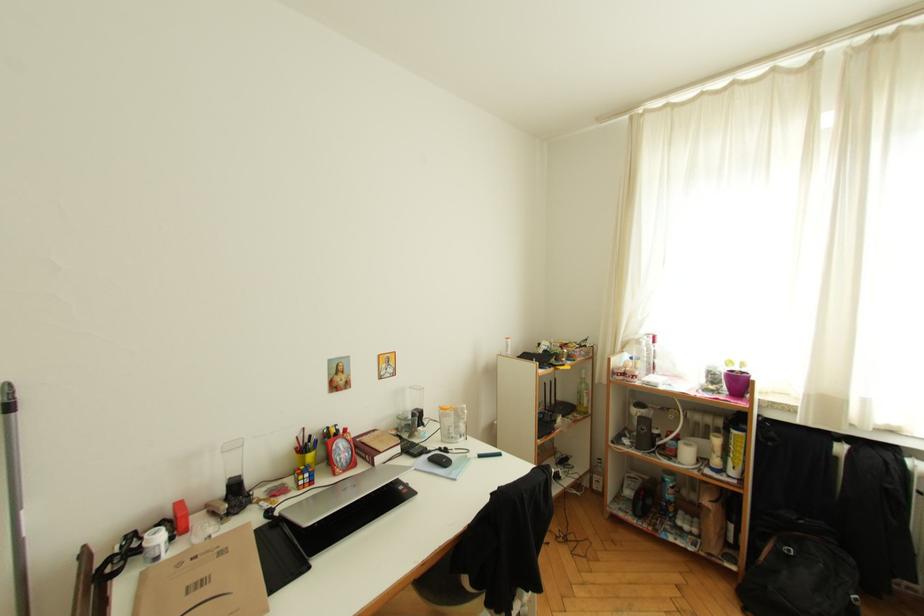
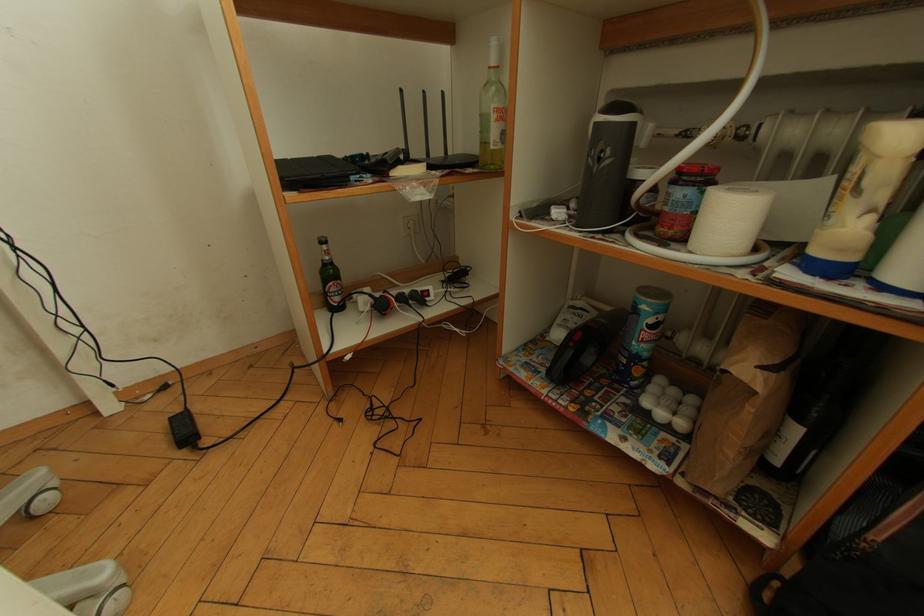
Which direction would the cameraman need to move to produce the second image?

The cameraman moved toward right, forward.